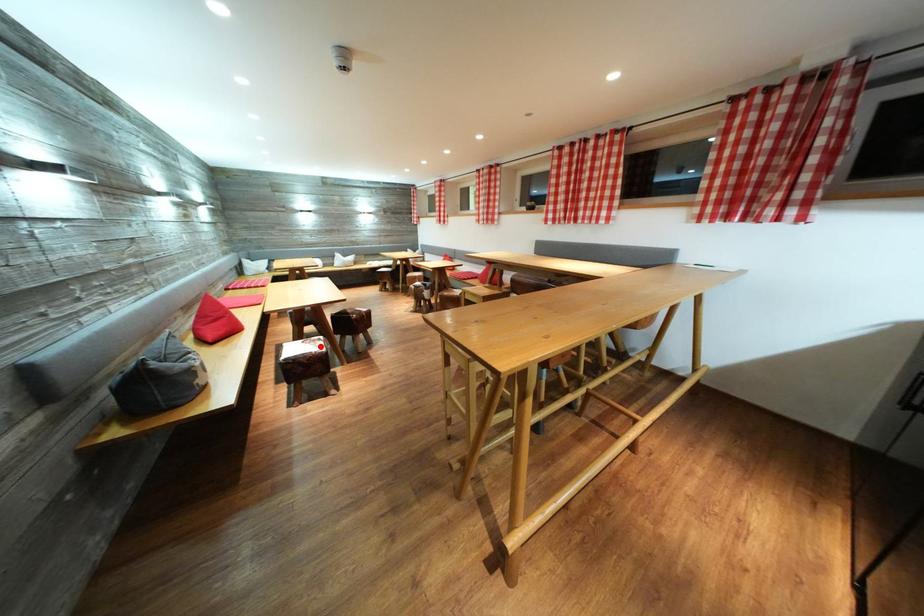
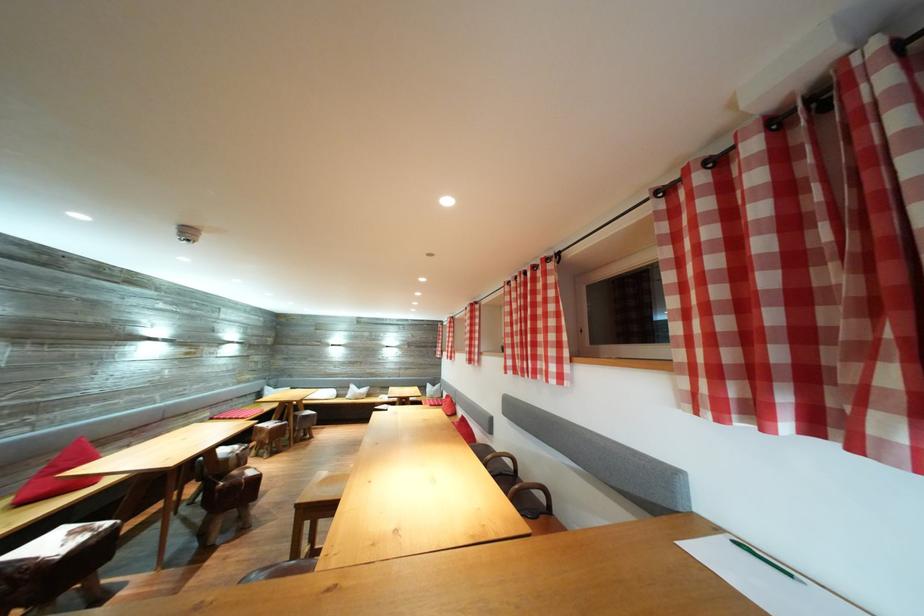
Question: I am providing you with two images of the same scene from different viewpoints. A red point is shown in image1. For the corresponding object point in image2, is it positioned nearer or farther from the camera?

Choices:
 (A) Nearer
 (B) Farther

Answer: (B)